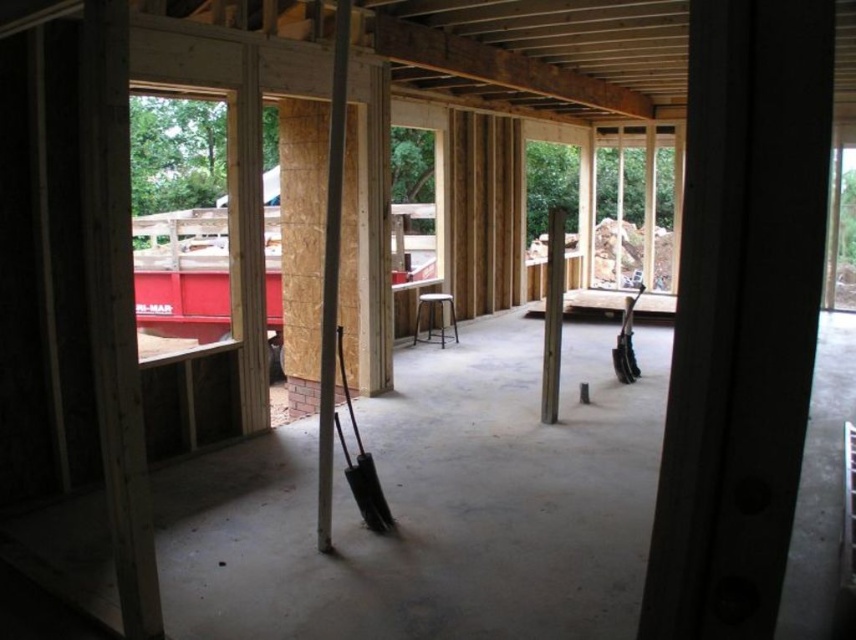
Who is lower down, smooth wood pillar at center or black plastic shovel at center?

black plastic shovel at center

Image resolution: width=856 pixels, height=640 pixels. Find the location of `smooth wood pillar at center`. smooth wood pillar at center is located at coordinates (551, 314).

Is point (336, 65) positioned after point (635, 360)?

No.

Is smooth wood beam at center positioned behind black plastic shovel at right?

That is False.

Find the location of `smooth wood beam at center`. smooth wood beam at center is located at coordinates (331, 273).

I want to click on smooth wood beam at center, so click(x=331, y=273).

Based on the photo, is smooth wood beam at center smaller than black plastic shovel at center?

No, smooth wood beam at center is not smaller than black plastic shovel at center.

How distant is smooth wood beam at center from black plastic shovel at center?

smooth wood beam at center and black plastic shovel at center are 16.44 inches apart from each other.

Where is `smooth wood beam at center`? smooth wood beam at center is located at coordinates coord(331,273).

I want to click on smooth wood beam at center, so pos(331,273).